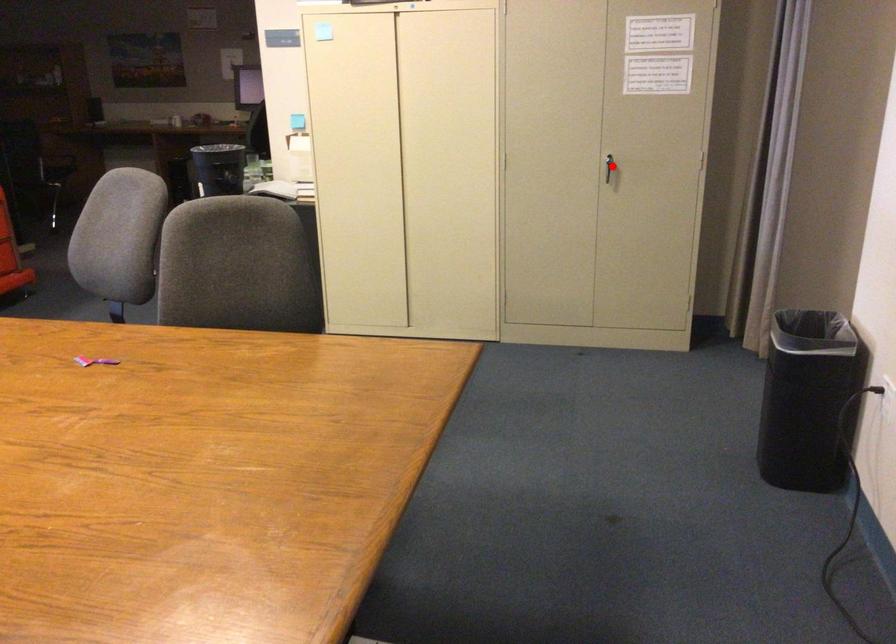
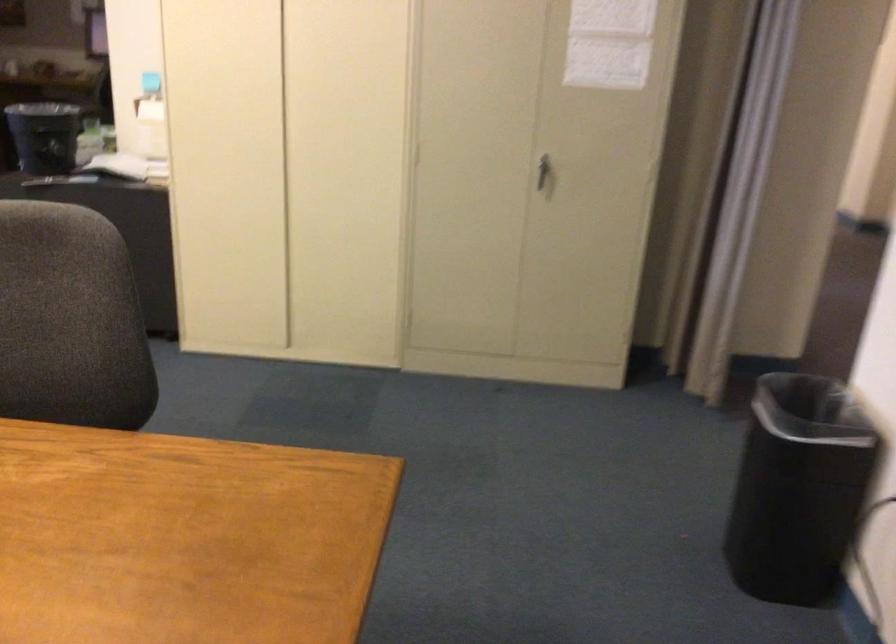
Question: A red point is marked in image1. In image2, is the corresponding 3D point closer to the camera or farther? Reply with the corresponding letter.

Choices:
 (A) The corresponding 3D point is closer.
 (B) The corresponding 3D point is farther.

Answer: (A)